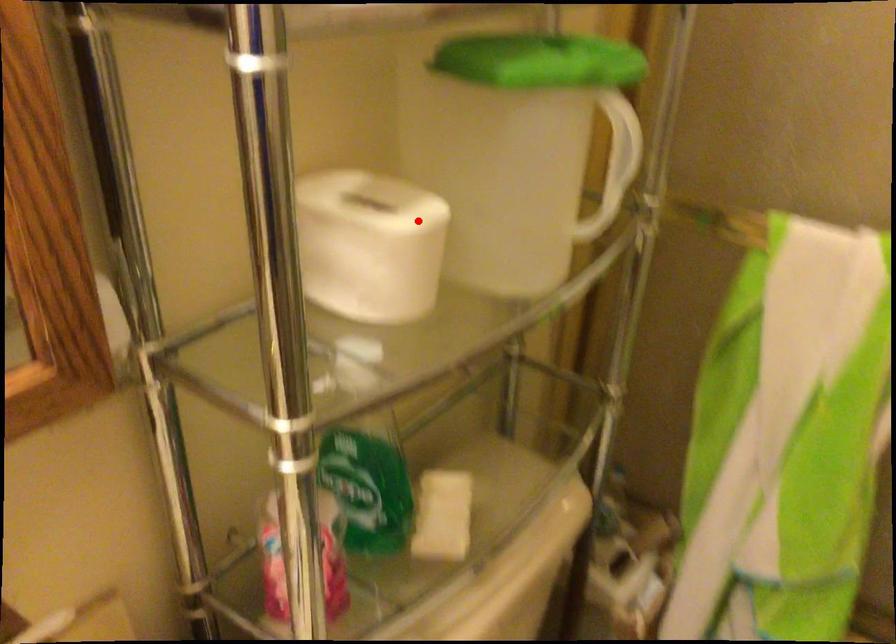
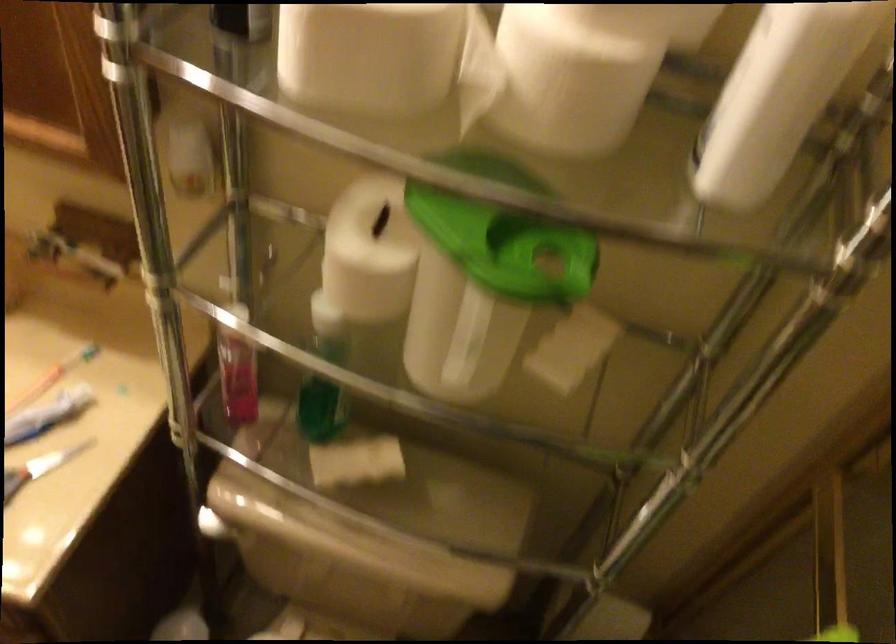
Find the pixel in the second image that matches the highlighted location in the first image.

(369, 252)